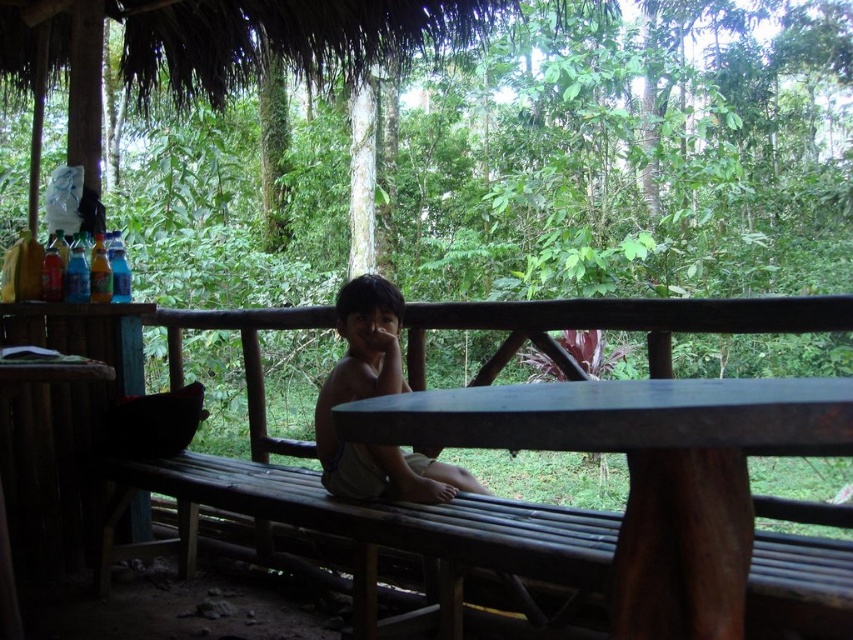
Question: Is the position of smooth dark wood table at center less distant than that of brown skin/softobject at center?

Choices:
 (A) yes
 (B) no

Answer: (A)

Question: Is smooth dark wood table at center above brown skin/softobject at center?

Choices:
 (A) yes
 (B) no

Answer: (B)

Question: Among these points, which one is nearest to the camera?

Choices:
 (A) (695, 611)
 (B) (351, 454)

Answer: (A)

Question: Does smooth dark wood table at center appear on the left side of brown skin/softobject at center?

Choices:
 (A) no
 (B) yes

Answer: (A)